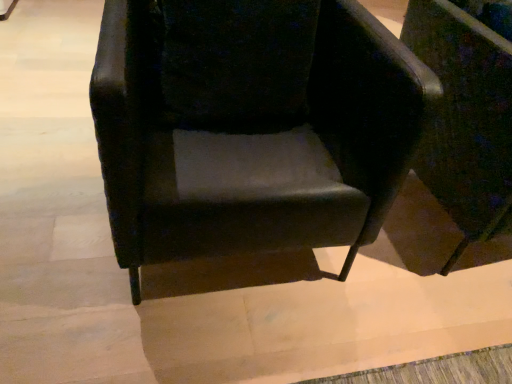
The width and height of the screenshot is (512, 384). Identify the location of vacant space to the left of velvet black armchair at center, marked as the 1th chair in a left-to-right arrangement. (54, 180).